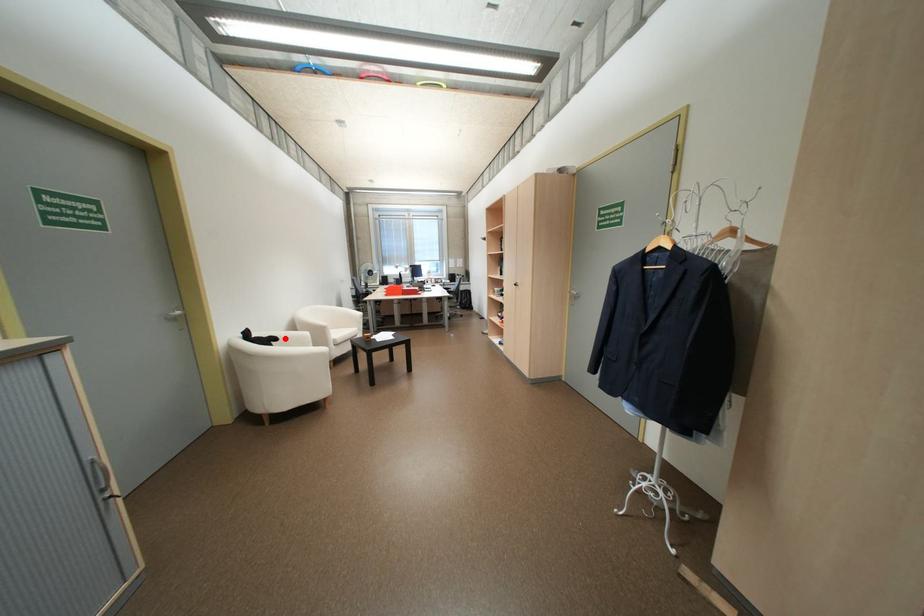
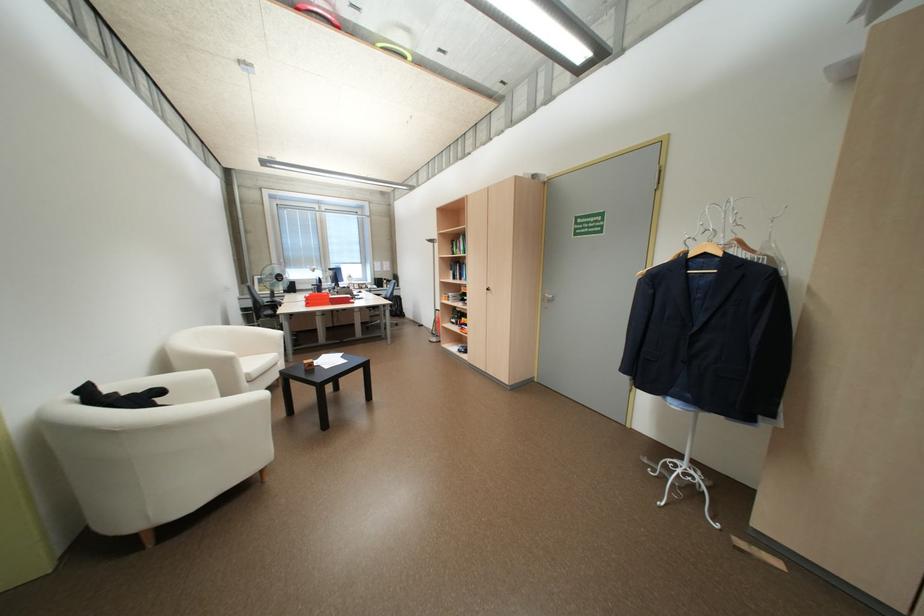
Question: I am providing you with two images of the same scene from different viewpoints. A red point is shown in image1. For the corresponding object point in image2, is it positioned nearer or farther from the camera?

Choices:
 (A) Nearer
 (B) Farther

Answer: (B)